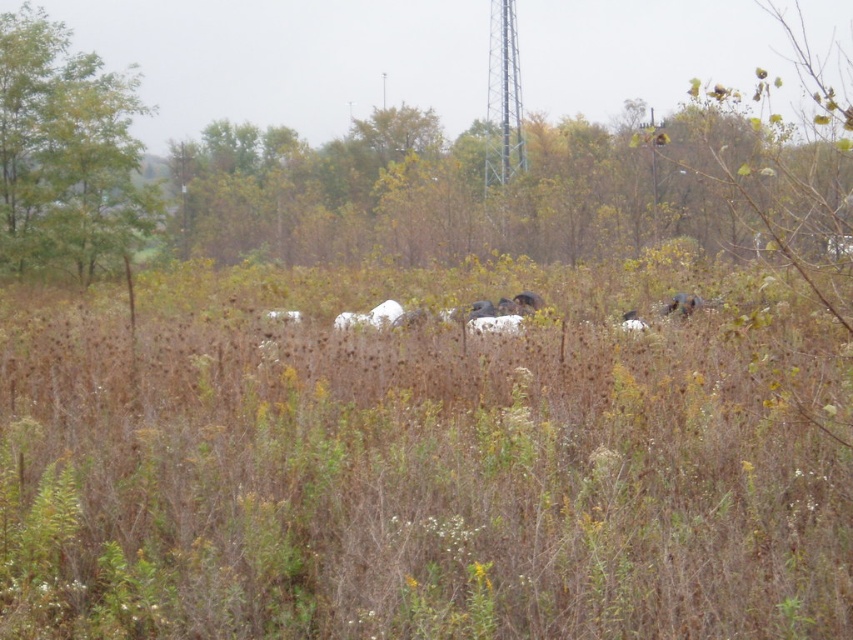
Can you confirm if white matte hay bales at center is thinner than green leafy tree at upper left?

No, white matte hay bales at center is not thinner than green leafy tree at upper left.

Who is more forward, (450,433) or (80,188)?

Positioned in front is point (450,433).

Is point (627, 460) more distant than point (90, 77)?

That is False.

In order to click on white matte hay bales at center in this screenshot , I will do `click(424, 458)`.

Who is more forward, (541, 180) or (679, 300)?

Point (679, 300) is in front.

From the picture: Is green leafy tree at upper center wider than brown furry animal at center-right?

Yes, green leafy tree at upper center is wider than brown furry animal at center-right.

At what (x,y) coordinates should I click in order to perform the action: click on green leafy tree at upper center. Please return your answer as a coordinate pair (x, y). This screenshot has width=853, height=640. Looking at the image, I should click on (453, 196).

Looking at this image, can you confirm if green leafy tree at upper center is wider than green leafy tree at upper left?

Correct, the width of green leafy tree at upper center exceeds that of green leafy tree at upper left.

Who is taller, green leafy tree at upper center or green leafy tree at upper left?

green leafy tree at upper center is taller.

Is point (287, 200) positioned behind point (38, 92)?

Yes, it is behind point (38, 92).

The image size is (853, 640). I want to click on green leafy tree at upper center, so click(453, 196).